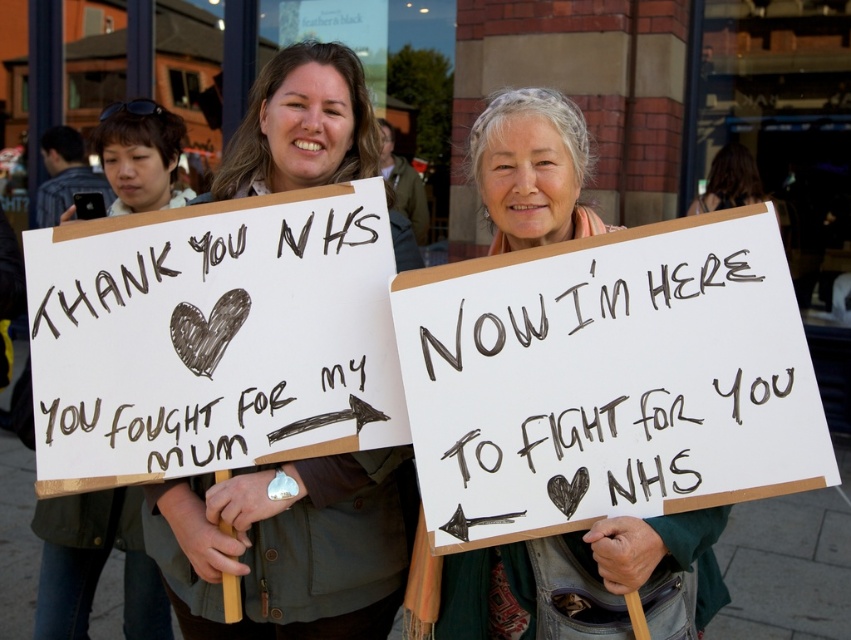
Who is positioned more to the left, white paper at center or matte brown jacket at center?

white paper at center is more to the left.

Between white paper at center and matte brown jacket at center, which one appears on the right side from the viewer's perspective?

From the viewer's perspective, matte brown jacket at center appears more on the right side.

Consider the image. Measure the distance between point (223, 413) and camera.

6.81 feet

I want to click on white paper at center, so click(x=212, y=339).

Does white paper at center have a larger size compared to green fabric scarf at center?

No, white paper at center is not bigger than green fabric scarf at center.

Between point (306, 324) and point (512, 144), which one is positioned in front?

Point (306, 324) is more forward.

Identify the location of white paper at center. Image resolution: width=851 pixels, height=640 pixels. (212, 339).

Can you confirm if black handwritten text at center is shorter than white paper at center?

Yes, black handwritten text at center is shorter than white paper at center.

Is black handwritten text at center bigger than white paper at center?

Actually, black handwritten text at center might be smaller than white paper at center.

Is point (532, 451) farther from viewer compared to point (113, 420)?

No, (532, 451) is closer to viewer.

Where is `black handwritten text at center`? black handwritten text at center is located at coordinates coord(609,380).